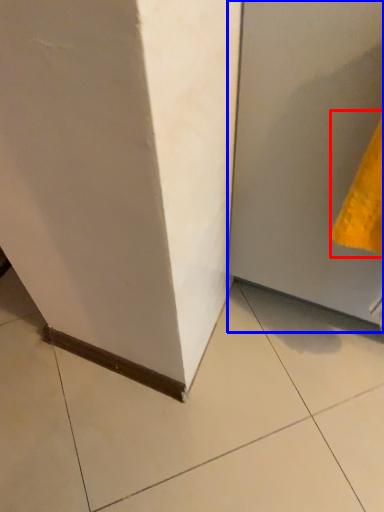
Question: Among these objects, which one is farthest to the camera, hand towel (highlighted by a red box) or door (highlighted by a blue box)?

Choices:
 (A) hand towel
 (B) door

Answer: (A)